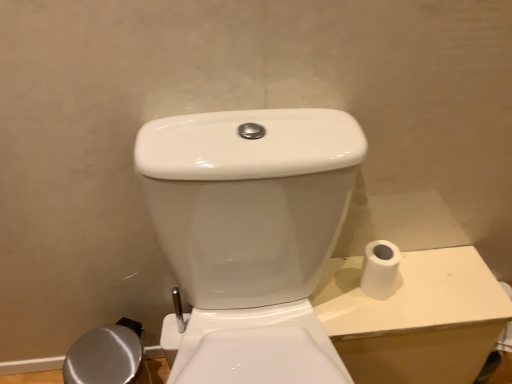
Locate an element on the screen. This screenshot has width=512, height=384. white glossy porcelain at right is located at coordinates (415, 317).

What do you see at coordinates (415, 317) in the screenshot? The image size is (512, 384). I see `white glossy porcelain at right` at bounding box center [415, 317].

You are a GUI agent. You are given a task and a screenshot of the screen. Output one action in this format:
    pyautogui.click(x=<x>, y=<y>)
    Task: Click on the white matte toilet paper at right
    This screenshot has width=512, height=384.
    Given the screenshot: What is the action you would take?
    pyautogui.click(x=380, y=269)

Describe the element at coordinates (380, 269) in the screenshot. The width and height of the screenshot is (512, 384). I see `white matte toilet paper at right` at that location.

The height and width of the screenshot is (384, 512). In order to click on white glossy porcelain at right in this screenshot , I will do `click(415, 317)`.

Can you confirm if white matte toilet paper at right is positioned to the left of white glossy porcelain at right?

Correct, you'll find white matte toilet paper at right to the left of white glossy porcelain at right.

Is the position of white matte toilet paper at right more distant than that of white glossy porcelain at right?

No, it is in front of white glossy porcelain at right.

Which is less distant, [386,259] or [412,255]?

Positioned in front is point [386,259].

From the image's perspective, which one is positioned higher, white matte toilet paper at right or white glossy porcelain at right?

white matte toilet paper at right, from the image's perspective.

From a real-world perspective, is white matte toilet paper at right over white glossy porcelain at right?

Yes.

In the scene shown: Is white matte toilet paper at right wider than white glossy porcelain at right?

In fact, white matte toilet paper at right might be narrower than white glossy porcelain at right.

Consider the image. Does white matte toilet paper at right have a lesser height compared to white glossy porcelain at right?

Indeed, white matte toilet paper at right has a lesser height compared to white glossy porcelain at right.

Looking at this image, does white matte toilet paper at right have a smaller size compared to white glossy porcelain at right?

Yes, white matte toilet paper at right is smaller than white glossy porcelain at right.

Would you say white glossy porcelain at right is part of white matte toilet paper at right's contents?

Definitely not — white glossy porcelain at right is not inside white matte toilet paper at right.

Does white matte toilet paper at right touch white glossy porcelain at right?

white matte toilet paper at right is not next to white glossy porcelain at right, and they're not touching.

Is white matte toilet paper at right oriented towards white glossy porcelain at right?

No, white matte toilet paper at right is not oriented towards white glossy porcelain at right.

The height and width of the screenshot is (384, 512). Identify the location of porcelain lying behind the white matte toilet paper at right. (415, 317).

Is white glossy porcelain at right to the left or to the right of white matte toilet paper at right in the image?

white glossy porcelain at right is to the right of white matte toilet paper at right.

Which is in front, white glossy porcelain at right or white matte toilet paper at right?

white matte toilet paper at right is more forward.

Which is in front, point (390, 348) or point (371, 280)?

The point (371, 280) is closer to the camera.

From the image's perspective, is white glossy porcelain at right below white matte toilet paper at right?

Correct, white glossy porcelain at right appears lower than white matte toilet paper at right in the image.

From a real-world perspective, who is located lower, white glossy porcelain at right or white matte toilet paper at right?

In real-world perspective, white glossy porcelain at right is lower.

Is white glossy porcelain at right wider or thinner than white matte toilet paper at right?

Considering their sizes, white glossy porcelain at right looks broader than white matte toilet paper at right.

Does white glossy porcelain at right have a lesser height compared to white matte toilet paper at right?

No, white glossy porcelain at right is not shorter than white matte toilet paper at right.

Which of these two, white glossy porcelain at right or white matte toilet paper at right, is bigger?

Bigger between the two is white glossy porcelain at right.

Does white glossy porcelain at right contain white matte toilet paper at right?

Actually, white matte toilet paper at right is outside white glossy porcelain at right.

Can you see white glossy porcelain at right touching white matte toilet paper at right?

white glossy porcelain at right and white matte toilet paper at right are clearly separated.

Could you tell me if white glossy porcelain at right is facing white matte toilet paper at right?

No.

How many degrees apart are the facing directions of white glossy porcelain at right and white matte toilet paper at right?

The angle between the facing direction of white glossy porcelain at right and the facing direction of white matte toilet paper at right is 2.86 degrees.

How much distance is there between white glossy porcelain at right and white matte toilet paper at right?

5.45 inches.

I want to click on toilet paper that is above the white glossy porcelain at right (from a real-world perspective), so click(380, 269).

Where is `toilet paper that appears in front of the white glossy porcelain at right`? The height and width of the screenshot is (384, 512). toilet paper that appears in front of the white glossy porcelain at right is located at coordinates (380, 269).

You are a GUI agent. You are given a task and a screenshot of the screen. Output one action in this format:
    pyautogui.click(x=<x>, y=<y>)
    Task: Click on the toilet paper on the left of the white glossy porcelain at right
    Image resolution: width=512 pixels, height=384 pixels.
    Given the screenshot: What is the action you would take?
    pos(380,269)